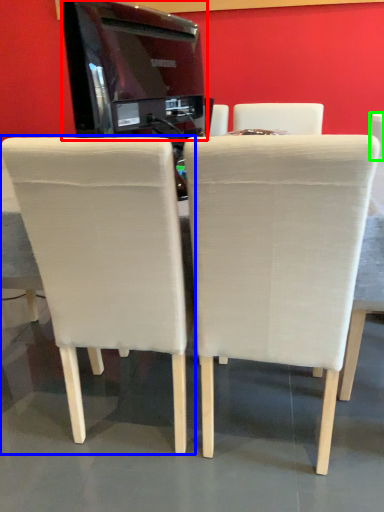
Question: Which is nearer to the appliance (highlighted by a red box)? chair (highlighted by a blue box) or chair (highlighted by a green box).

Choices:
 (A) chair
 (B) chair

Answer: (A)